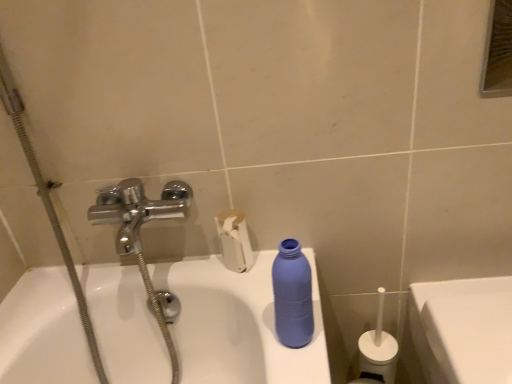
The image size is (512, 384). What do you see at coordinates (234, 240) in the screenshot?
I see `white matte toilet paper at upper center` at bounding box center [234, 240].

I want to click on matte blue plastic bottle at center, so click(292, 295).

I want to click on white matte toilet paper at upper center, so click(234, 240).

At what (x,y) coordinates should I click in order to perform the action: click on mirror that is behind the white glossy porcelain at lower right. Please return your answer as a coordinate pair (x, y). Looking at the image, I should click on (498, 52).

Would you say white glossy porcelain at lower right is to the left or to the right of metallic rectangular mirror at upper right in the picture?

From the image, it's evident that white glossy porcelain at lower right is to the right of metallic rectangular mirror at upper right.

From the image's perspective, is white glossy porcelain at lower right under metallic rectangular mirror at upper right?

Indeed, from the image's perspective, white glossy porcelain at lower right is shown beneath metallic rectangular mirror at upper right.

Considering the relative sizes of white glossy porcelain at lower right and metallic rectangular mirror at upper right in the image provided, is white glossy porcelain at lower right wider than metallic rectangular mirror at upper right?

Yes, white glossy porcelain at lower right is wider than metallic rectangular mirror at upper right.

Is white matte toilet paper at upper center facing away from metallic rectangular mirror at upper right?

No.

From the image's perspective, between white matte toilet paper at upper center and metallic rectangular mirror at upper right, who is located below?

white matte toilet paper at upper center appears lower in the image.

Is white matte toilet paper at upper center bigger or smaller than metallic rectangular mirror at upper right?

white matte toilet paper at upper center is bigger than metallic rectangular mirror at upper right.

How distant is white matte toilet paper at upper center from metallic rectangular mirror at upper right?

white matte toilet paper at upper center and metallic rectangular mirror at upper right are 1.84 meters apart from each other.

The width and height of the screenshot is (512, 384). I want to click on cleaning product lying on the right of white matte toilet paper at upper center, so click(292, 295).

Considering the sizes of matte blue plastic bottle at center and white matte toilet paper at upper center in the image, is matte blue plastic bottle at center bigger or smaller than white matte toilet paper at upper center?

Clearly, matte blue plastic bottle at center is smaller in size than white matte toilet paper at upper center.

From the picture: Could you tell me if matte blue plastic bottle at center is facing white matte toilet paper at upper center?

No.

From a real-world perspective, is matte blue plastic bottle at center positioned over white matte toilet paper at upper center based on gravity?

Yes, from a real-world perspective, matte blue plastic bottle at center is above white matte toilet paper at upper center.

Is white matte toilet paper at upper center taller or shorter than white glossy porcelain at lower right?

white matte toilet paper at upper center is shorter than white glossy porcelain at lower right.

Consider the image. Choose the correct answer: Is white matte toilet paper at upper center inside white glossy porcelain at lower right or outside it?

The correct answer is: outside.

Which is more to the right, white matte toilet paper at upper center or white glossy porcelain at lower right?

white glossy porcelain at lower right is more to the right.

Considering the positions of points (238, 259) and (490, 336), is point (238, 259) farther from camera compared to point (490, 336)?

Yes.

Is metallic rectangular mirror at upper right positioned in front of white matte toilet paper at upper center?

Yes.

In the scene shown: Could you tell me if metallic rectangular mirror at upper right is turned towards white matte toilet paper at upper center?

No, metallic rectangular mirror at upper right is not facing towards white matte toilet paper at upper center.

From a real-world perspective, relative to white matte toilet paper at upper center, is metallic rectangular mirror at upper right vertically above or below?

From a real-world perspective, metallic rectangular mirror at upper right is physically above white matte toilet paper at upper center.

Considering the relative sizes of metallic rectangular mirror at upper right and white matte toilet paper at upper center in the image provided, is metallic rectangular mirror at upper right thinner than white matte toilet paper at upper center?

Yes, metallic rectangular mirror at upper right is thinner than white matte toilet paper at upper center.

From a real-world perspective, which object rests below the other?

white glossy porcelain at lower right is physically lower.

Is point (503, 353) positioned before point (226, 215)?

Yes, point (503, 353) is closer to viewer.

Considering their positions, is white glossy porcelain at lower right located in front of or behind white matte toilet paper at upper center?

white glossy porcelain at lower right is in front of white matte toilet paper at upper center.

Based on the photo, which of these two, white glossy porcelain at lower right or white matte toilet paper at upper center, is bigger?

white glossy porcelain at lower right.

I want to click on porcelain behind the matte blue plastic bottle at center, so click(463, 329).

Between matte blue plastic bottle at center and white glossy porcelain at lower right, which one has smaller size?

matte blue plastic bottle at center is smaller.

From the image's perspective, between matte blue plastic bottle at center and white glossy porcelain at lower right, who is located below?

white glossy porcelain at lower right, from the image's perspective.

Image resolution: width=512 pixels, height=384 pixels. I want to click on mirror that is above the white glossy porcelain at lower right (from the image's perspective), so click(498, 52).

Find the location of a particular element. The width and height of the screenshot is (512, 384). mirror located on the right of white matte toilet paper at upper center is located at coordinates (498, 52).

Looking at the image, which one is located further to white matte toilet paper at upper center, metallic rectangular mirror at upper right or white glossy porcelain at lower right?

metallic rectangular mirror at upper right is positioned further to the anchor white matte toilet paper at upper center.

When comparing their distances from metallic rectangular mirror at upper right, does white matte toilet paper at upper center or white glossy porcelain at lower right seem further?

white matte toilet paper at upper center lies further to metallic rectangular mirror at upper right than the other object.

From the image, which object appears to be nearer to white glossy porcelain at lower right, metallic rectangular mirror at upper right or matte blue plastic bottle at center?

matte blue plastic bottle at center is positioned closer to the anchor white glossy porcelain at lower right.

From the image, which object appears to be nearer to white matte toilet paper at upper center, white glossy porcelain at lower right or metallic rectangular mirror at upper right?

white glossy porcelain at lower right.

Considering their positions, is white matte toilet paper at upper center positioned closer to metallic rectangular mirror at upper right than matte blue plastic bottle at center?

Among the two, white matte toilet paper at upper center is located nearer to metallic rectangular mirror at upper right.

When comparing their distances from white matte toilet paper at upper center, does metallic rectangular mirror at upper right or matte blue plastic bottle at center seem closer?

matte blue plastic bottle at center lies closer to white matte toilet paper at upper center than the other object.

When comparing their distances from white glossy porcelain at lower right, does white matte toilet paper at upper center or matte blue plastic bottle at center seem closer?

The object closer to white glossy porcelain at lower right is matte blue plastic bottle at center.

Estimate the real-world distances between objects in this image. Which object is further from white glossy porcelain at lower right, white matte toilet paper at upper center or metallic rectangular mirror at upper right?

metallic rectangular mirror at upper right is further to white glossy porcelain at lower right.

Locate an element on the screen. This screenshot has width=512, height=384. cleaning product located between white matte toilet paper at upper center and white glossy porcelain at lower right in the left-right direction is located at coordinates (292, 295).

This screenshot has height=384, width=512. Identify the location of cleaning product between metallic rectangular mirror at upper right and white glossy porcelain at lower right from top to bottom. (292, 295).

Locate an element on the screen. The height and width of the screenshot is (384, 512). cleaning product between white matte toilet paper at upper center and metallic rectangular mirror at upper right is located at coordinates pyautogui.click(x=292, y=295).

This screenshot has height=384, width=512. What are the coordinates of `toilet paper between metallic rectangular mirror at upper right and white glossy porcelain at lower right in the up-down direction` in the screenshot? It's located at (234, 240).